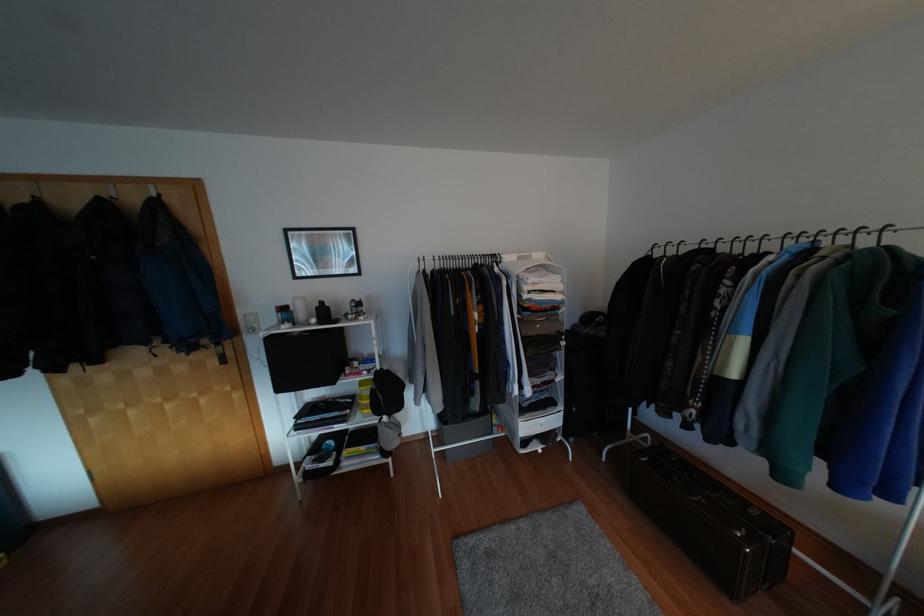
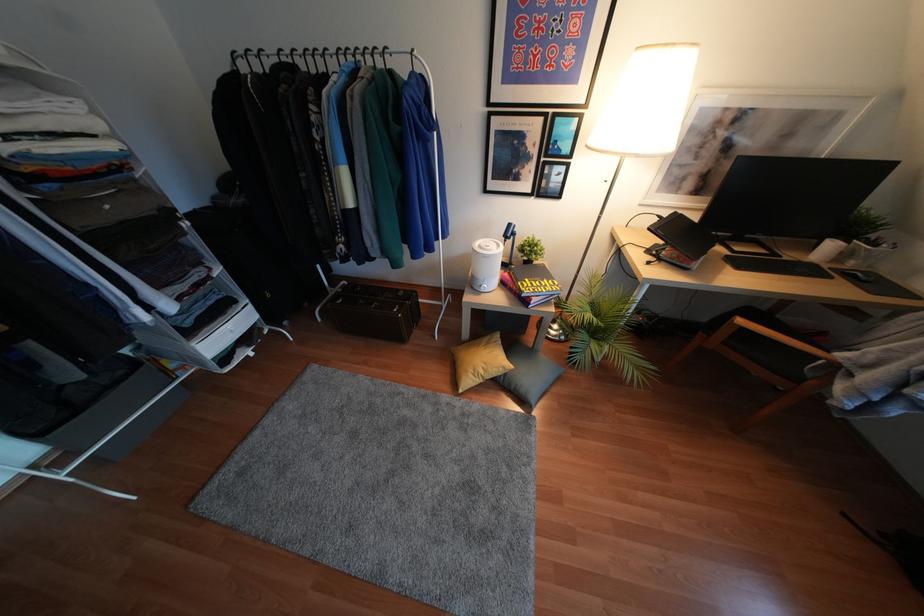
The first image is from the beginning of the video and the second image is from the end. How did the camera likely rotate when shooting the video?

The rotation direction of the camera is right-down.